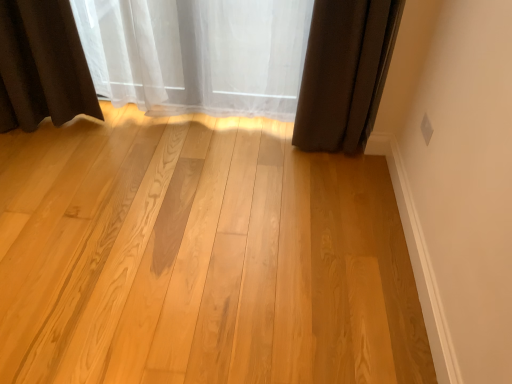
The image size is (512, 384). In order to click on light wood plank at center in this screenshot , I will do `click(200, 257)`.

The width and height of the screenshot is (512, 384). Find the location of `dark brown fabric curtain at upper right, the 1th curtain in the right-to-left sequence`. dark brown fabric curtain at upper right, the 1th curtain in the right-to-left sequence is located at coordinates (345, 73).

Locate an element on the screen. light wood plank at center is located at coordinates (200, 257).

Looking at this image, could you measure the distance between dark brown fabric curtain at upper right, the 1th curtain in the right-to-left sequence, and light wood plank at center?

They are 28.08 inches apart.

Considering the relative sizes of dark brown fabric curtain at upper right, the 1th curtain in the right-to-left sequence, and light wood plank at center in the image provided, is dark brown fabric curtain at upper right, the 1th curtain in the right-to-left sequence, shorter than light wood plank at center?

Incorrect, the height of dark brown fabric curtain at upper right, the 1th curtain in the right-to-left sequence, does not fall short of that of light wood plank at center.

Is dark brown fabric curtain at upper right, the 1th curtain in the right-to-left sequence, far away from light wood plank at center?

No.

Considering the positions of points (334, 10) and (400, 359), is point (334, 10) farther from camera compared to point (400, 359)?

That is True.

Is light wood plank at center further to the viewer compared to dark brown fabric curtain at upper right, the 1th curtain in the right-to-left sequence?

No, it is not.

Can you confirm if light wood plank at center is bigger than dark brown fabric curtain at upper right, arranged as the second curtain when viewed from the left?

Indeed, light wood plank at center has a larger size compared to dark brown fabric curtain at upper right, arranged as the second curtain when viewed from the left.

Choose the correct answer: Is light wood plank at center inside white sheer curtain at upper center, arranged as the 2th curtain when viewed from the right, or outside it?

light wood plank at center is outside white sheer curtain at upper center, arranged as the 2th curtain when viewed from the right.

Is light wood plank at center positioned far away from white sheer curtain at upper center, arranged as the 2th curtain when viewed from the right?

No.

Looking at this image, which point is more distant from viewer, (x=88, y=196) or (x=126, y=67)?

The point (x=126, y=67) is farther from the camera.

Between light wood plank at center and white sheer curtain at upper center, arranged as the first curtain when viewed from the left, which one has larger size?

light wood plank at center.

Does white sheer curtain at upper center, arranged as the first curtain when viewed from the left, turn towards dark brown fabric curtain at upper right, arranged as the second curtain when viewed from the left?

No, white sheer curtain at upper center, arranged as the first curtain when viewed from the left, is not oriented towards dark brown fabric curtain at upper right, arranged as the second curtain when viewed from the left.

How far apart are white sheer curtain at upper center, arranged as the first curtain when viewed from the left, and dark brown fabric curtain at upper right, the 1th curtain in the right-to-left sequence?

They are 18.70 inches apart.

Identify the location of curtain located below the white sheer curtain at upper center, arranged as the 2th curtain when viewed from the right (from the image's perspective). The width and height of the screenshot is (512, 384). (345, 73).

Would you consider white sheer curtain at upper center, arranged as the 2th curtain when viewed from the right, to be distant from dark brown fabric curtain at upper right, arranged as the second curtain when viewed from the left?

No, white sheer curtain at upper center, arranged as the 2th curtain when viewed from the right, is not far away from dark brown fabric curtain at upper right, arranged as the second curtain when viewed from the left.

Can you tell me how much dark brown fabric curtain at upper right, arranged as the second curtain when viewed from the left, and white sheer curtain at upper center, arranged as the first curtain when viewed from the left, differ in facing direction?

The facing directions of dark brown fabric curtain at upper right, arranged as the second curtain when viewed from the left, and white sheer curtain at upper center, arranged as the first curtain when viewed from the left, are 1.81 degrees apart.

Is dark brown fabric curtain at upper right, arranged as the second curtain when viewed from the left, further to camera compared to white sheer curtain at upper center, arranged as the first curtain when viewed from the left?

No, dark brown fabric curtain at upper right, arranged as the second curtain when viewed from the left, is closer to the viewer.

Image resolution: width=512 pixels, height=384 pixels. What are the coordinates of `curtain above the white sheer curtain at upper center, arranged as the 2th curtain when viewed from the right (from a real-world perspective)` in the screenshot? It's located at (345, 73).

From the picture: From a real-world perspective, which object rests below the other?

From a 3D spatial view, white sheer curtain at upper center, arranged as the 2th curtain when viewed from the right, is below.

Which object is further away from the camera, white sheer curtain at upper center, arranged as the first curtain when viewed from the left, or light wood plank at center?

white sheer curtain at upper center, arranged as the first curtain when viewed from the left, is more distant.

Is white sheer curtain at upper center, arranged as the 2th curtain when viewed from the right, to the right of light wood plank at center from the viewer's perspective?

Correct, you'll find white sheer curtain at upper center, arranged as the 2th curtain when viewed from the right, to the right of light wood plank at center.

How many degrees apart are the facing directions of white sheer curtain at upper center, arranged as the 2th curtain when viewed from the right, and light wood plank at center?

They differ by 1.15 degrees in their facing directions.

Can you confirm if white sheer curtain at upper center, arranged as the first curtain when viewed from the left, is thinner than light wood plank at center?

Yes.

Identify the location of plank lying on the left of dark brown fabric curtain at upper right, arranged as the second curtain when viewed from the left. The width and height of the screenshot is (512, 384). (200, 257).

From a real-world perspective, which curtain is the 2nd one above the light wood plank at center? Please provide its 2D coordinates.

[(345, 73)]

Looking at the image, which one is located further to white sheer curtain at upper center, arranged as the 2th curtain when viewed from the right, dark brown fabric curtain at upper right, the 1th curtain in the right-to-left sequence, or light wood plank at center?

light wood plank at center is further to white sheer curtain at upper center, arranged as the 2th curtain when viewed from the right.

Which object lies nearer to the anchor point light wood plank at center, dark brown fabric curtain at upper right, the 1th curtain in the right-to-left sequence, or white sheer curtain at upper center, arranged as the 2th curtain when viewed from the right?

dark brown fabric curtain at upper right, the 1th curtain in the right-to-left sequence, is positioned closer to the anchor light wood plank at center.

Which object lies nearer to the anchor point light wood plank at center, white sheer curtain at upper center, arranged as the 2th curtain when viewed from the right, or dark brown fabric curtain at upper right, arranged as the second curtain when viewed from the left?

dark brown fabric curtain at upper right, arranged as the second curtain when viewed from the left, is positioned closer to the anchor light wood plank at center.

From the image, which object appears to be nearer to dark brown fabric curtain at upper right, the 1th curtain in the right-to-left sequence, white sheer curtain at upper center, arranged as the first curtain when viewed from the left, or light wood plank at center?

Among the two, white sheer curtain at upper center, arranged as the first curtain when viewed from the left, is located nearer to dark brown fabric curtain at upper right, the 1th curtain in the right-to-left sequence.

Considering their positions, is light wood plank at center positioned closer to white sheer curtain at upper center, arranged as the 2th curtain when viewed from the right, than dark brown fabric curtain at upper right, the 1th curtain in the right-to-left sequence?

Among the two, dark brown fabric curtain at upper right, the 1th curtain in the right-to-left sequence, is located nearer to white sheer curtain at upper center, arranged as the 2th curtain when viewed from the right.

When comparing their distances from dark brown fabric curtain at upper right, the 1th curtain in the right-to-left sequence, does light wood plank at center or white sheer curtain at upper center, arranged as the 2th curtain when viewed from the right, seem further?

The object further to dark brown fabric curtain at upper right, the 1th curtain in the right-to-left sequence, is light wood plank at center.

Locate an element on the screen. The width and height of the screenshot is (512, 384). curtain between light wood plank at center and dark brown fabric curtain at upper right, the 1th curtain in the right-to-left sequence, in the horizontal direction is located at coordinates (197, 54).